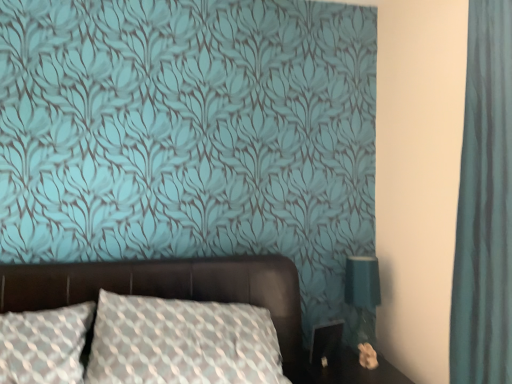
Question: Based on their positions, is leather bed at center located to the left or right of teal fabric lampshade at right?

Choices:
 (A) left
 (B) right

Answer: (A)

Question: Is point (180, 264) closer or farther from the camera than point (373, 294)?

Choices:
 (A) farther
 (B) closer

Answer: (B)

Question: Which of these objects is positioned farthest from the teal fabric lampshade at right?

Choices:
 (A) black glossy table at lower right
 (B) teal fabric curtain at right
 (C) leather bed at center

Answer: (B)

Question: Estimate the real-world distances between objects in this image. Which object is closer to the teal fabric lampshade at right?

Choices:
 (A) black glossy table at lower right
 (B) teal fabric curtain at right
 (C) leather bed at center

Answer: (A)